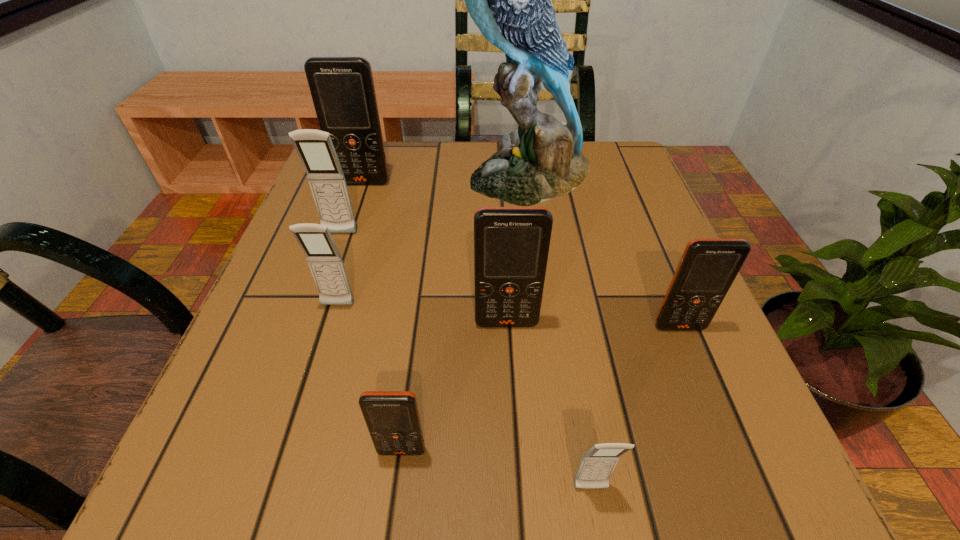
The image size is (960, 540). What are the coordinates of `vacant region at the left edge` in the screenshot? It's located at (300, 292).

Identify the location of vacant space at the right edge. The width and height of the screenshot is (960, 540). (603, 222).

In order to click on free space at the near left corner of the desktop in this screenshot , I will do `click(259, 449)`.

Where is `vacant space at the far right corner`? This screenshot has height=540, width=960. vacant space at the far right corner is located at coordinates 588,185.

I want to click on vacant space at the near right corner of the desktop, so [x=691, y=464].

Find the location of `free spot between the rightmost orange cellular telephone and the nearest gray cellular telephone`. free spot between the rightmost orange cellular telephone and the nearest gray cellular telephone is located at coordinates (636, 408).

Identify the location of free space between the fourth cellular telephone from right to left and the parakeet. Image resolution: width=960 pixels, height=540 pixels. (465, 313).

Where is `empty location between the smallest orange cellular telephone and the rightmost orange cellular telephone`? The image size is (960, 540). empty location between the smallest orange cellular telephone and the rightmost orange cellular telephone is located at coordinates (540, 389).

The image size is (960, 540). In order to click on free space between the second biggest gray cellular telephone and the parakeet in this screenshot , I will do tap(432, 240).

Where is `vacant space in between the second biggest orange cellular telephone and the second farthest cellular telephone`? The height and width of the screenshot is (540, 960). vacant space in between the second biggest orange cellular telephone and the second farthest cellular telephone is located at coordinates tap(423, 279).